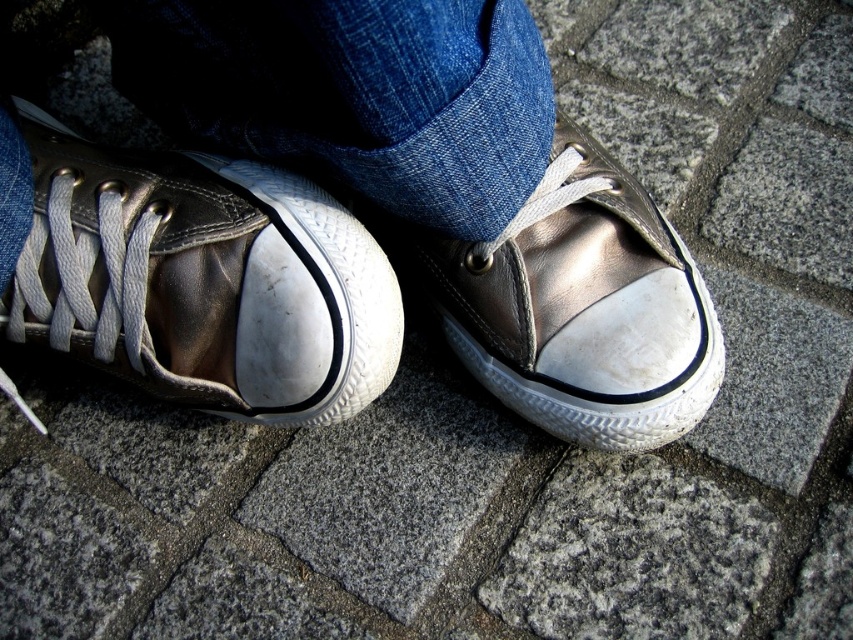
Can you confirm if metallic leather sneaker at center is bigger than metallic leather shoe at center?

Yes.

Can you confirm if metallic leather sneaker at center is positioned above metallic leather shoe at center?

Yes.

Between point (22, 262) and point (525, 275), which one is positioned in front?

Point (22, 262) is in front.

At what (x,y) coordinates should I click in order to perform the action: click on metallic leather sneaker at center. Please return your answer as a coordinate pair (x, y). Looking at the image, I should click on (202, 280).

Between point (184, 371) and point (108, 3), which one is positioned in front?

Point (108, 3)

Consider the image. Between metallic leather sneaker at center and denim at center, which one is positioned lower?

metallic leather sneaker at center is lower down.

Does point (363, 364) come behind point (160, 33)?

Yes, point (363, 364) is farther from viewer.

You are a GUI agent. You are given a task and a screenshot of the screen. Output one action in this format:
    pyautogui.click(x=<x>, y=<y>)
    Task: Click on the metallic leather sneaker at center
    
    Given the screenshot: What is the action you would take?
    pyautogui.click(x=202, y=280)

Can you confirm if denim at center is thinner than metallic leather shoe at center?

No, denim at center is not thinner than metallic leather shoe at center.

Does denim at center have a greater height compared to metallic leather shoe at center?

No.

Between point (254, 51) and point (538, 305), which one is positioned in front?

Point (254, 51) is more forward.

Locate an element on the screen. This screenshot has width=853, height=640. denim at center is located at coordinates (352, 93).